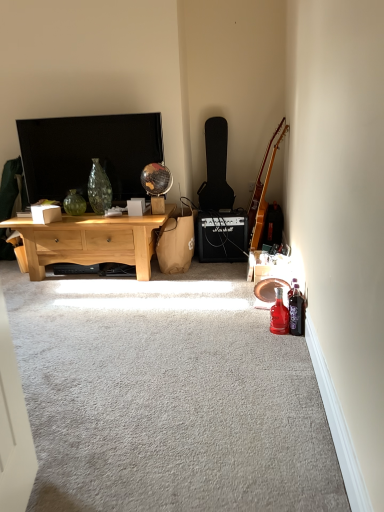
You are a GUI agent. You are given a task and a screenshot of the screen. Output one action in this format:
    pyautogui.click(x=<x>, y=<y>)
    Task: Click on the vacant space situated on the left part of translucent glass bottle at lower right, arranged as the 1th bottle when viewed from the left
    The image size is (384, 512).
    Given the screenshot: What is the action you would take?
    251,326